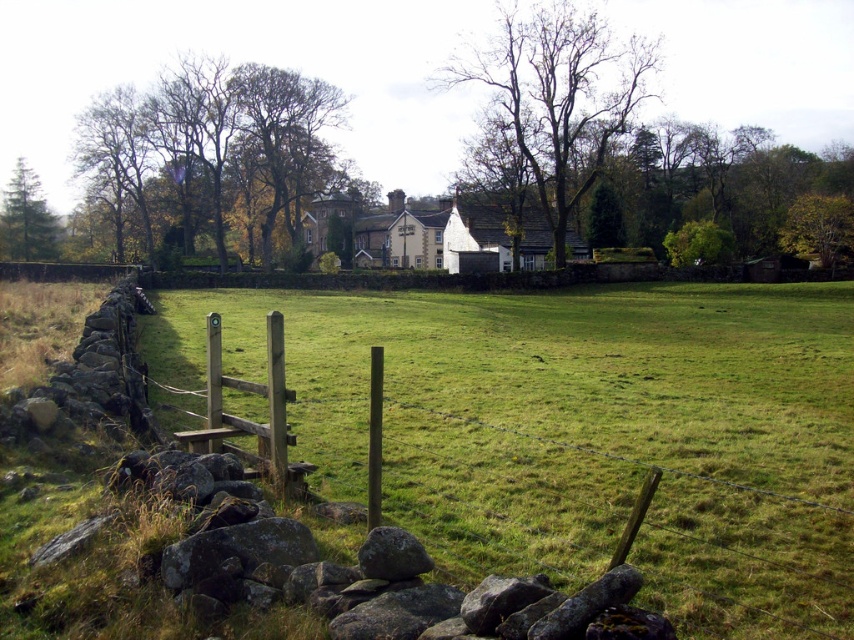
Who is positioned more to the left, brown textured tree at upper center or green textured pine tree at left?

green textured pine tree at left

Is point (594, 128) behind point (0, 232)?

No.

I want to click on brown textured tree at upper center, so click(x=559, y=97).

Looking at this image, is green grass at lower left further to the viewer compared to brown leafy tree at upper left?

No.

Locate an element on the screen. green grass at lower left is located at coordinates (578, 432).

Does point (849, 412) come closer to viewer compared to point (330, 148)?

Yes, point (849, 412) is in front of point (330, 148).

Where is `green grass at lower left`? green grass at lower left is located at coordinates (578, 432).

Is brown textured tree at upper center positioned at the back of smooth gray rock at lower center?

Yes, brown textured tree at upper center is behind smooth gray rock at lower center.

I want to click on brown textured tree at upper center, so tap(559, 97).

Where is `brown textured tree at upper center`? brown textured tree at upper center is located at coordinates (559, 97).